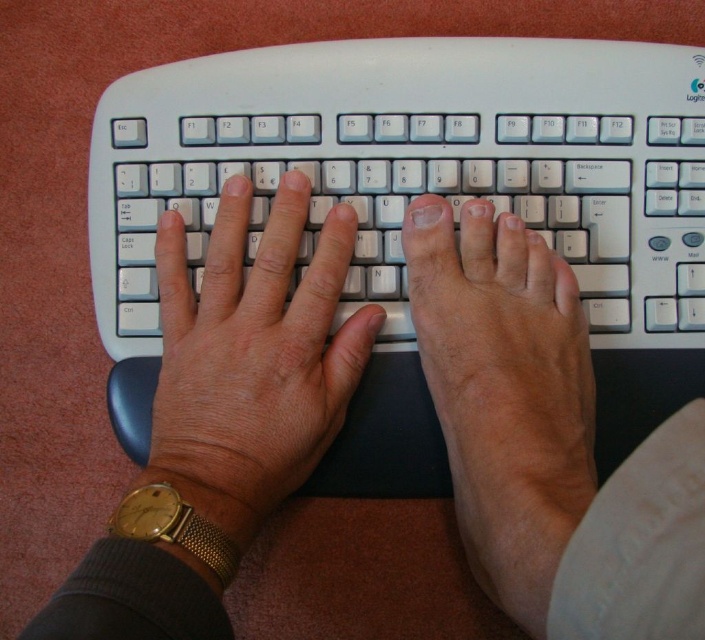
Who is positioned more to the right, smooth skin hands at center or matte white foot at center?

matte white foot at center is more to the right.

This screenshot has width=705, height=640. What do you see at coordinates (221, 420) in the screenshot?
I see `smooth skin hands at center` at bounding box center [221, 420].

The height and width of the screenshot is (640, 705). Describe the element at coordinates (221, 420) in the screenshot. I see `smooth skin hands at center` at that location.

Image resolution: width=705 pixels, height=640 pixels. I want to click on smooth skin hands at center, so click(x=221, y=420).

Who is taller, smooth skin hands at center or white matte keyboard at center?

Standing taller between the two is smooth skin hands at center.

Describe the element at coordinates (221, 420) in the screenshot. This screenshot has width=705, height=640. I see `smooth skin hands at center` at that location.

Is point (166, 625) positioned in front of point (196, 472)?

Yes, point (166, 625) is closer to viewer.

The height and width of the screenshot is (640, 705). In order to click on smooth skin hands at center in this screenshot , I will do `click(221, 420)`.

Can you confirm if white plastic keyboard at center is smaller than matte white foot at center?

Correct, white plastic keyboard at center occupies less space than matte white foot at center.

Who is shorter, white plastic keyboard at center or matte white foot at center?

Standing shorter between the two is white plastic keyboard at center.

Where is `white plastic keyboard at center`? The width and height of the screenshot is (705, 640). white plastic keyboard at center is located at coordinates (417, 166).

Locate an element on the screen. The width and height of the screenshot is (705, 640). white plastic keyboard at center is located at coordinates (417, 166).